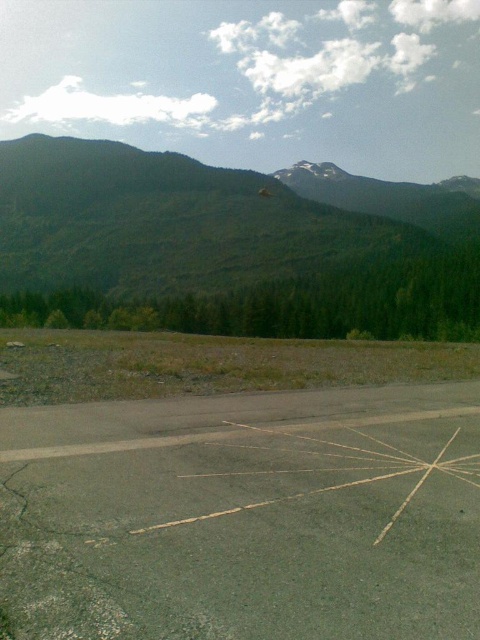
You are planning to build a new hiking trail starting from the gray asphalt parking lot at center and leading towards the green forested mountain at upper left. Considering their sizes, which area will require more space for construction?

The green forested mountain at upper left requires more space for construction because it has a larger size compared to the gray asphalt parking lot at center.

You are standing on the paved road in the foreground of the scene. You see two points marked on the road. The first point is at coordinates point (155, 592) and the second point is at point (315, 316). Which point is closer to you as you stand on the road?

Point (155, 592) is in front of point (315, 316), so it is closer to you.